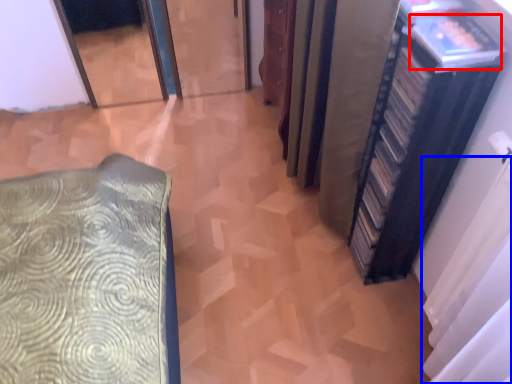
Question: Which object appears farthest to the camera in this image, book (highlighted by a red box) or curtain (highlighted by a blue box)?

Choices:
 (A) book
 (B) curtain

Answer: (A)